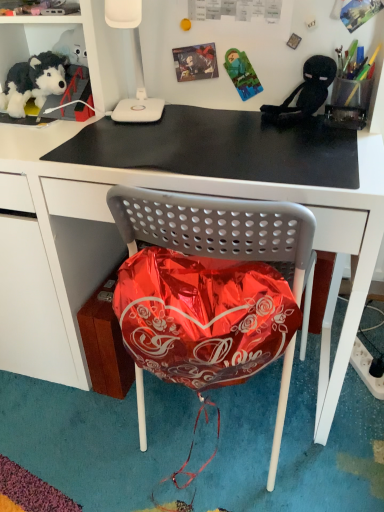
Question: In the image, is black matte mousepad at upper center on the left side or the right side of white plastic lamp at upper center?

Choices:
 (A) right
 (B) left

Answer: (A)

Question: From their relative heights in the image, would you say black matte mousepad at upper center is taller or shorter than white plastic lamp at upper center?

Choices:
 (A) tall
 (B) short

Answer: (B)

Question: Estimate the real-world distances between objects in this image. Which object is closer to the metallic red balloon at center?

Choices:
 (A) white plastic lamp at upper center
 (B) soft plush toy at upper left
 (C) black matte mousepad at upper center
 (D) black matte desk at center
 (E) black plush toy at upper right

Answer: (C)

Question: Based on their relative distances, which object is nearer to the white plastic lamp at upper center?

Choices:
 (A) black matte mousepad at upper center
 (B) soft plush toy at upper left
 (C) black matte desk at center
 (D) black plush toy at upper right
 (E) metallic red balloon at center

Answer: (A)